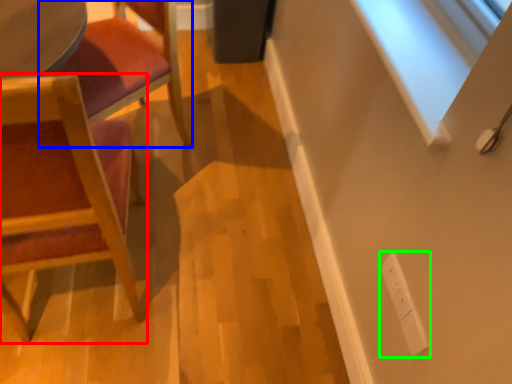
Question: Considering the real-world distances, which object is closest to chair (highlighted by a red box)? chair (highlighted by a blue box) or electric outlet (highlighted by a green box).

Choices:
 (A) chair
 (B) electric outlet

Answer: (A)